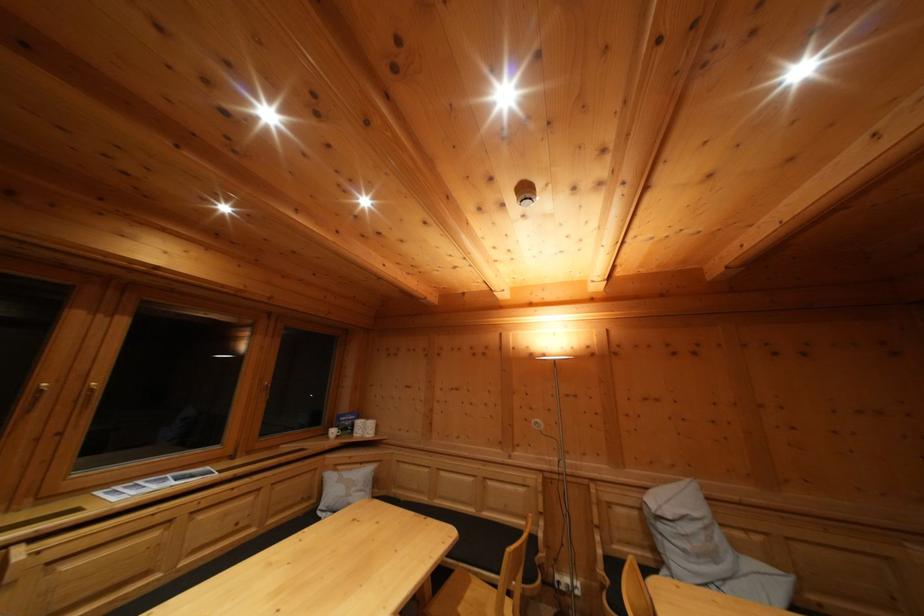
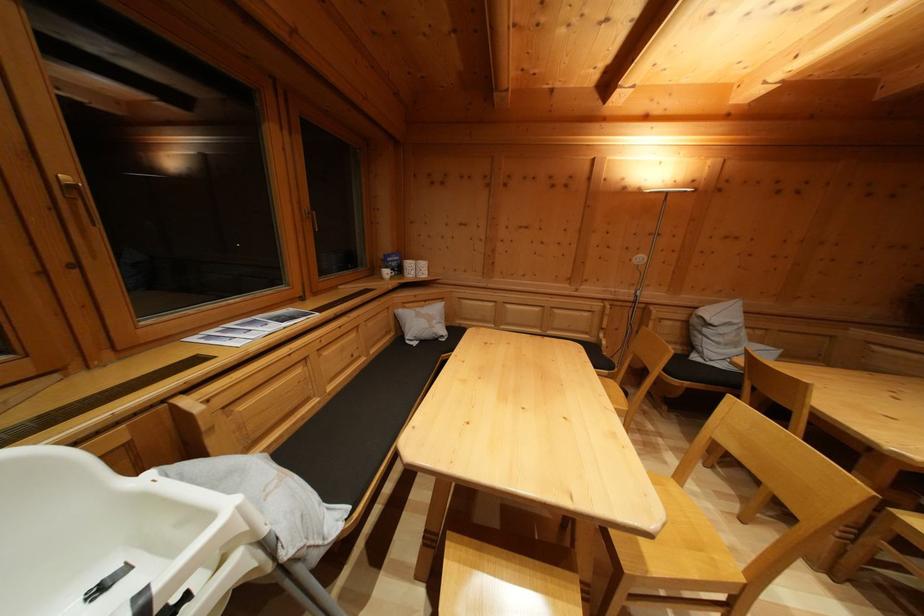
Where in the second image is the point corresponding to (x=666, y=533) from the first image?

(711, 337)